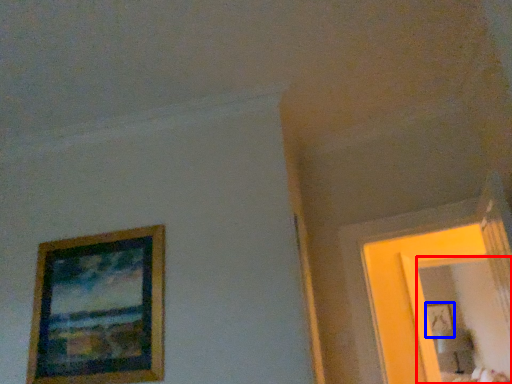
Question: Which object is closer to the camera taking this photo, mirror (highlighted by a red box) or picture frame (highlighted by a blue box)?

Choices:
 (A) mirror
 (B) picture frame

Answer: (A)